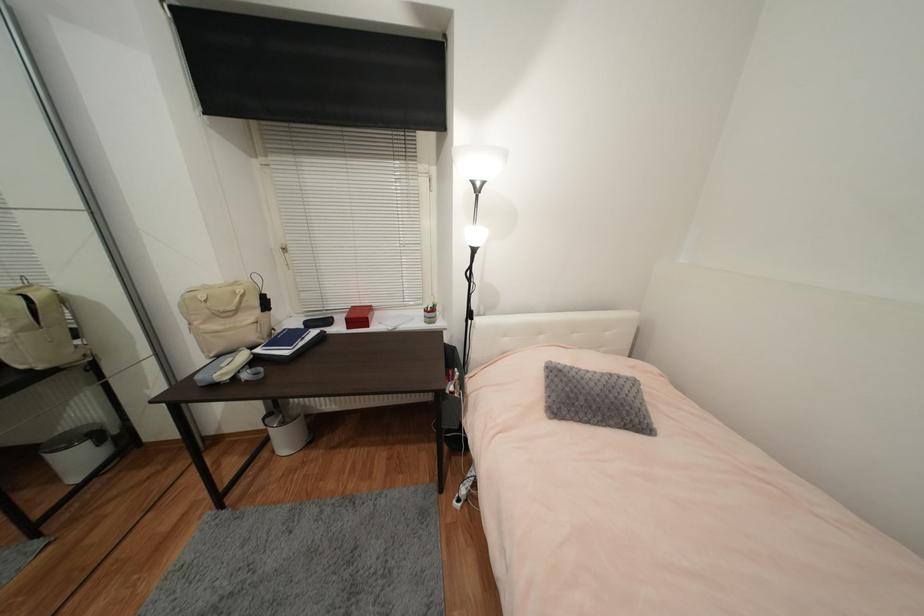
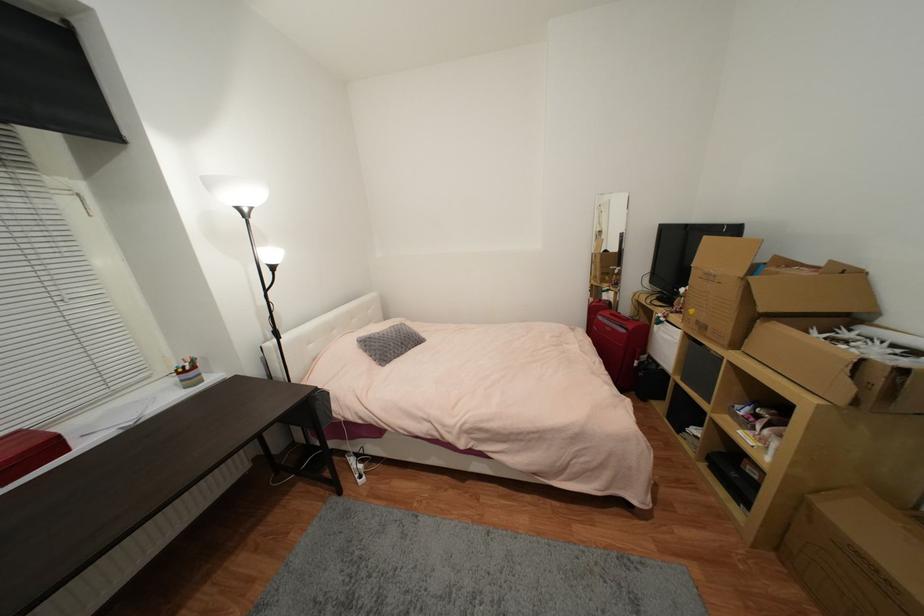
The point at (430,312) is marked in the first image. Where is the corresponding point in the second image?

(185, 374)